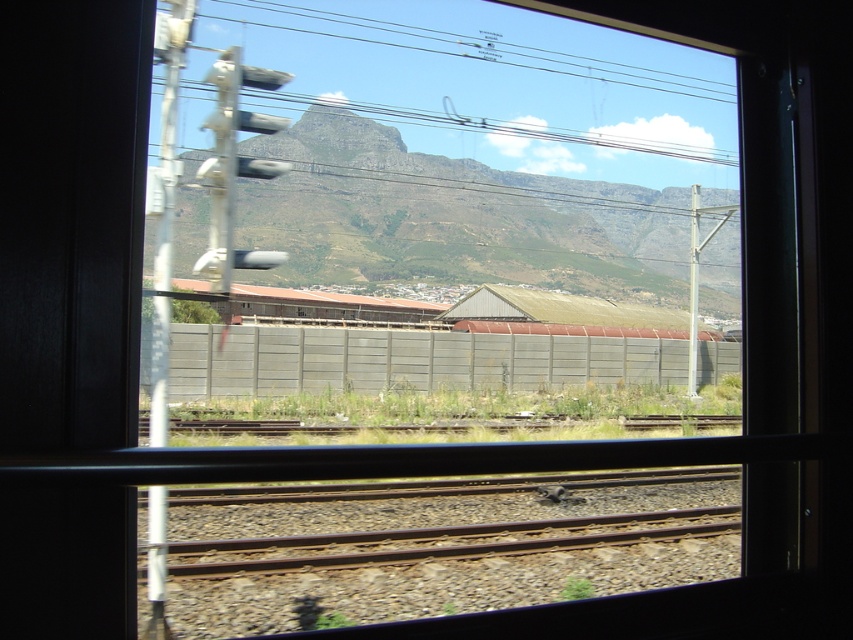
Looking at this image, you are a passenger on the train and looking out the window. You see the green grassy mountain at center and the rusty metal train track at bottom. Which one appears wider from your perspective?

The green grassy mountain at center appears wider than the rusty metal train track at bottom because its width is larger.